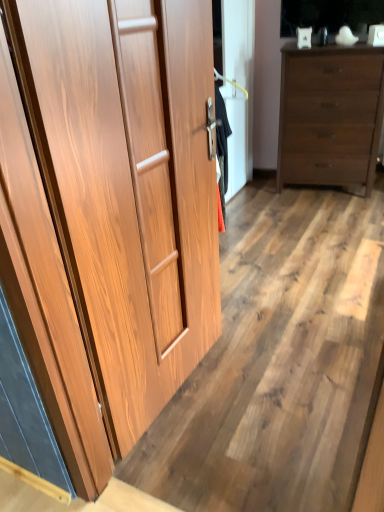
Question: Do you think wooden cupboard at left is within matte brown dresser at right, or outside of it?

Choices:
 (A) outside
 (B) inside

Answer: (A)

Question: Considering the relative positions of wooden cupboard at left and matte brown dresser at right in the image provided, is wooden cupboard at left to the left or to the right of matte brown dresser at right?

Choices:
 (A) right
 (B) left

Answer: (B)

Question: Estimate the real-world distances between objects in this image. Which object is farther from the wooden cupboard at left?

Choices:
 (A) matte brown dresser at right
 (B) wooden floor at center

Answer: (A)

Question: Which is nearer to the wooden cupboard at left?

Choices:
 (A) wooden floor at center
 (B) matte brown dresser at right

Answer: (A)